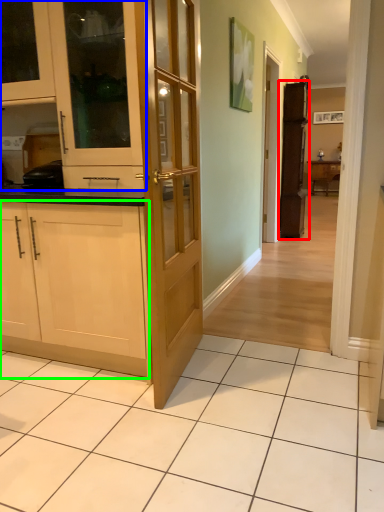
Question: Considering the real-world distances, which object is closest to cabinetry (highlighted by a red box)? cabinetry (highlighted by a blue box) or cabinetry (highlighted by a green box).

Choices:
 (A) cabinetry
 (B) cabinetry

Answer: (A)